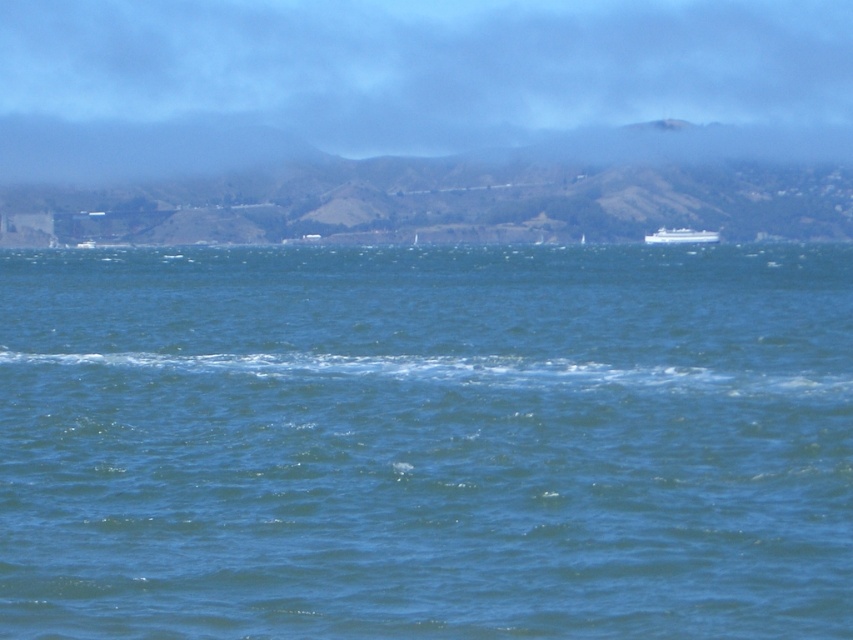
Between green grassy hill at center and white glossy cruise ship at center, which one has more height?

With more height is green grassy hill at center.

I want to click on green grassy hill at center, so click(416, 184).

Is point (596, 141) positioned behind point (668, 243)?

That is True.

The image size is (853, 640). I want to click on green grassy hill at center, so click(416, 184).

How far apart are blue liquid water at center and white glossy cruise ship at center?

They are 128.11 meters apart.

Between point (734, 275) and point (689, 228), which one is positioned in front?

Point (734, 275)

What are the coordinates of `blue liquid water at center` in the screenshot? It's located at (426, 442).

Which is below, blue liquid water at center or green grassy hill at center?

blue liquid water at center is below.

Is blue liquid water at center above green grassy hill at center?

Incorrect, blue liquid water at center is not positioned above green grassy hill at center.

From the picture: Who is more forward, (171, 292) or (479, 227)?

Point (171, 292)

At what (x,y) coordinates should I click in order to perform the action: click on blue liquid water at center. Please return your answer as a coordinate pair (x, y). The image size is (853, 640). Looking at the image, I should click on (426, 442).